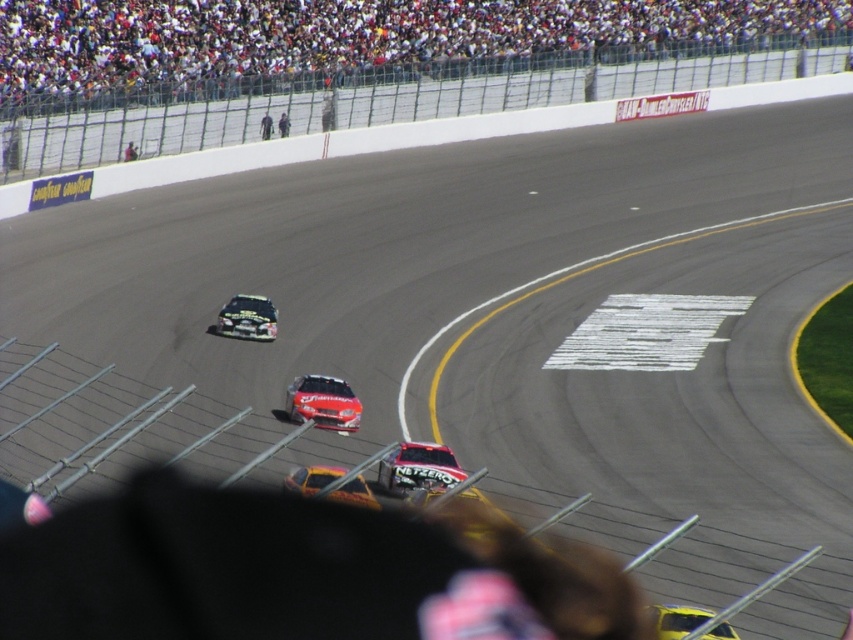
You are a race car driver trying to navigate the curve in the image. You see two points on the track marked as point (369, 496) and point (231, 323). Which point should you aim for first to stay on the optimal racing line?

You should aim for point (369, 496) first because it is in front of point (231, 323) along the track, which is the optimal racing line.

You are a race official at the NASCAR race. You need to determine if the shiny silver racecar at center and the dark blue suit at upper center are within the 30 meter safety distance rule. Can you confirm?

The shiny silver racecar at center and the dark blue suit at upper center are 27.55 meters apart, which is within the 30 meter safety distance rule.

You are a spectator at the NASCAR race and notice the yellow metallic car at center and the dark blue jacket at center. From your viewpoint, which object is located to the right?

The yellow metallic car at center is positioned on the right side of dark blue jacket at center, so the yellow metallic car at center is to the right.